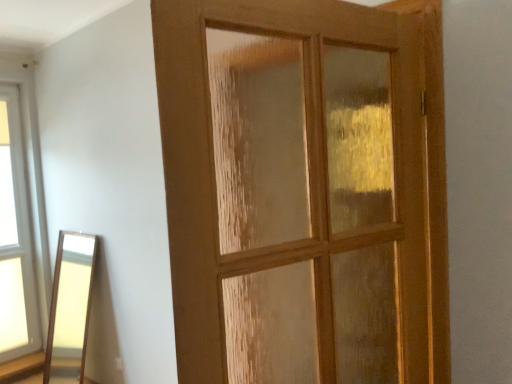
Question: Considering the relative sizes of clear glass window at left and wooden door at center in the image provided, is clear glass window at left bigger than wooden door at center?

Choices:
 (A) no
 (B) yes

Answer: (A)

Question: From the image's perspective, does clear glass window at left appear higher than wooden door at center?

Choices:
 (A) yes
 (B) no

Answer: (B)

Question: From the image's perspective, is clear glass window at left below wooden door at center?

Choices:
 (A) no
 (B) yes

Answer: (B)

Question: Is clear glass window at left at the left side of wooden door at center?

Choices:
 (A) yes
 (B) no

Answer: (A)

Question: Does clear glass window at left have a lesser width compared to wooden door at center?

Choices:
 (A) no
 (B) yes

Answer: (B)

Question: Is clear glass window at left outside of wooden door at center?

Choices:
 (A) no
 (B) yes

Answer: (B)

Question: Is wooden door at center smaller than clear glass window at left?

Choices:
 (A) no
 (B) yes

Answer: (A)

Question: From a real-world perspective, is wooden door at center positioned over clear glass window at left based on gravity?

Choices:
 (A) yes
 (B) no

Answer: (A)

Question: Is wooden door at center aimed at clear glass window at left?

Choices:
 (A) no
 (B) yes

Answer: (B)

Question: Are wooden door at center and clear glass window at left far apart?

Choices:
 (A) yes
 (B) no

Answer: (A)

Question: From the image's perspective, is wooden door at center located beneath clear glass window at left?

Choices:
 (A) yes
 (B) no

Answer: (B)

Question: Can you confirm if wooden door at center is shorter than clear glass window at left?

Choices:
 (A) no
 (B) yes

Answer: (B)

Question: From a real-world perspective, relative to clear glass window at left, is wooden door at center vertically above or below?

Choices:
 (A) below
 (B) above

Answer: (B)